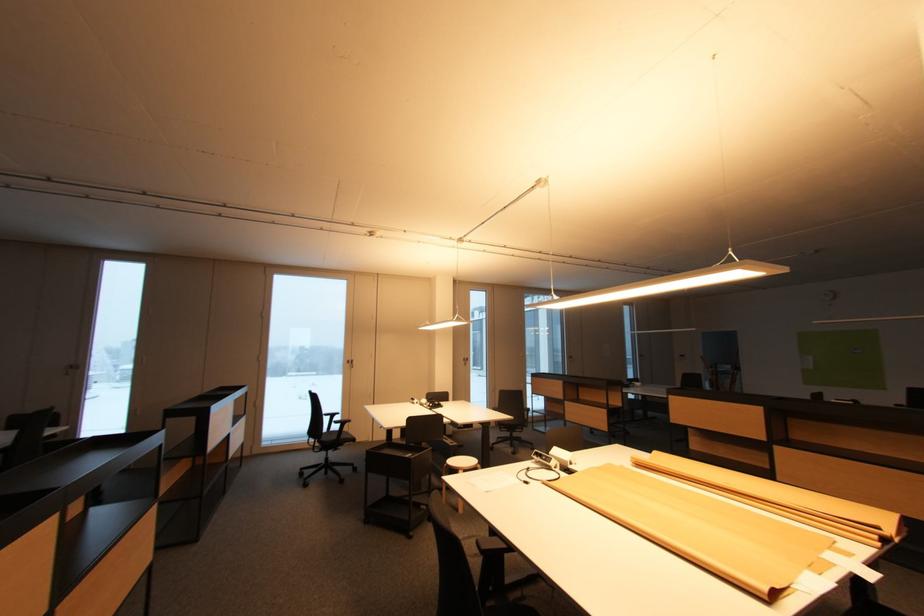
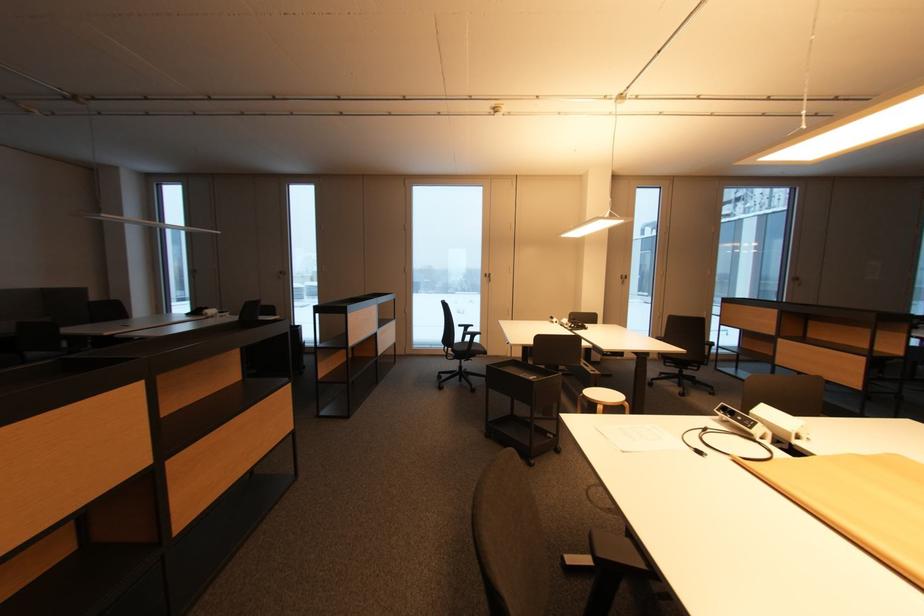
Question: The images are taken continuously from a first-person perspective. In which direction are you moving?

Choices:
 (A) Left
 (B) Right
 (C) Forward
 (D) Backward

Answer: (C)